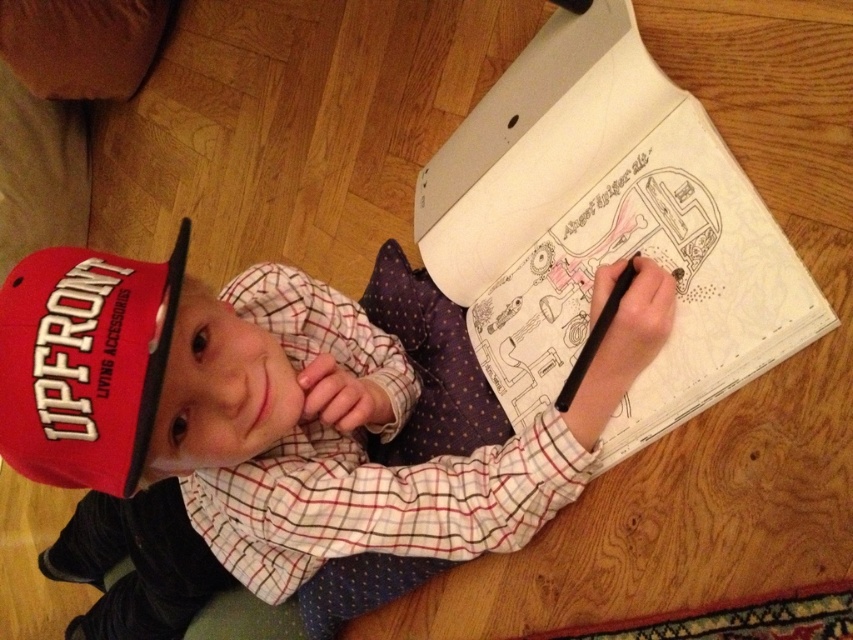
The image size is (853, 640). Describe the element at coordinates (256, 429) in the screenshot. I see `red matte cap at upper left` at that location.

At what (x,y) coordinates should I click in order to perform the action: click on red matte cap at upper left. Please return your answer as a coordinate pair (x, y). The image size is (853, 640). Looking at the image, I should click on (256, 429).

Find the location of `red matte cap at upper left`. red matte cap at upper left is located at coordinates (256, 429).

Who is higher up, red matte cap at upper left or white paper at center?

white paper at center is higher up.

Is red matte cap at upper left further to camera compared to white paper at center?

No, it is in front of white paper at center.

Between point (592, 420) and point (601, 164), which one is positioned behind?

The point (601, 164) is behind.

Find the location of a particular element. This screenshot has width=853, height=640. red matte cap at upper left is located at coordinates (256, 429).

Does point (670, 248) come in front of point (76, 291)?

No, it is not.

Which is in front, point (737, 304) or point (102, 392)?

Point (102, 392) is more forward.

Locate an element on the screen. This screenshot has height=640, width=853. white paper at center is located at coordinates (606, 228).